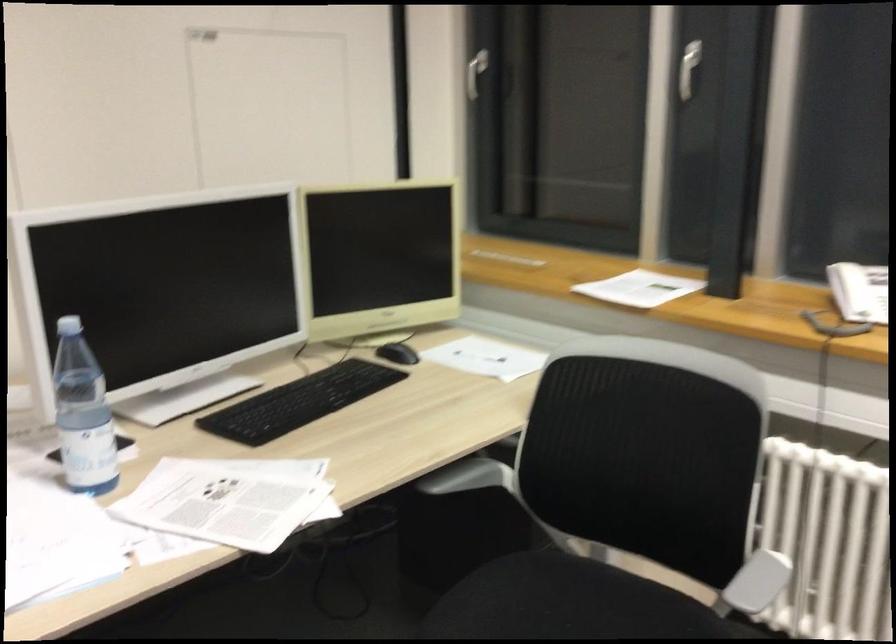
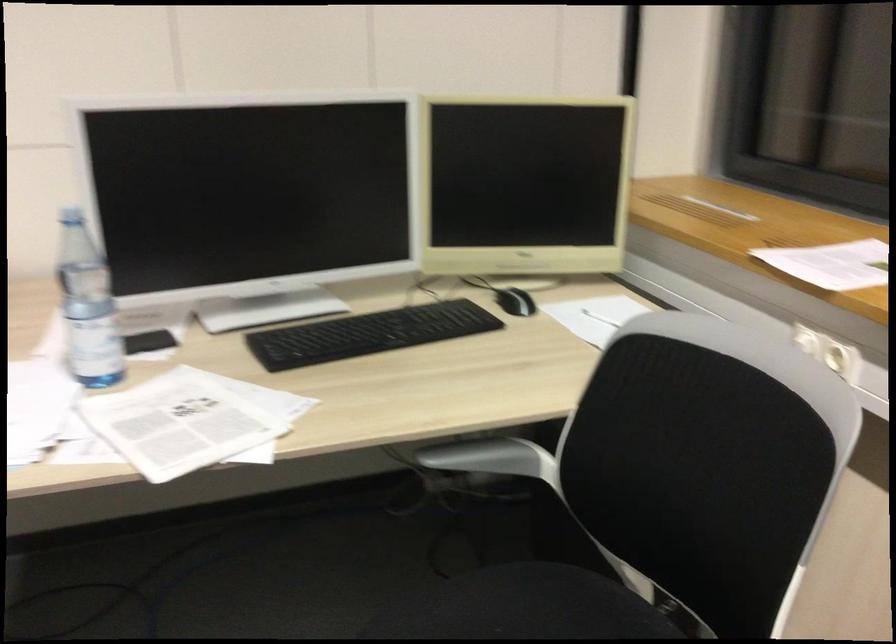
Which direction would the cameraman need to move to produce the second image?

The cameraman walked toward right, forward.